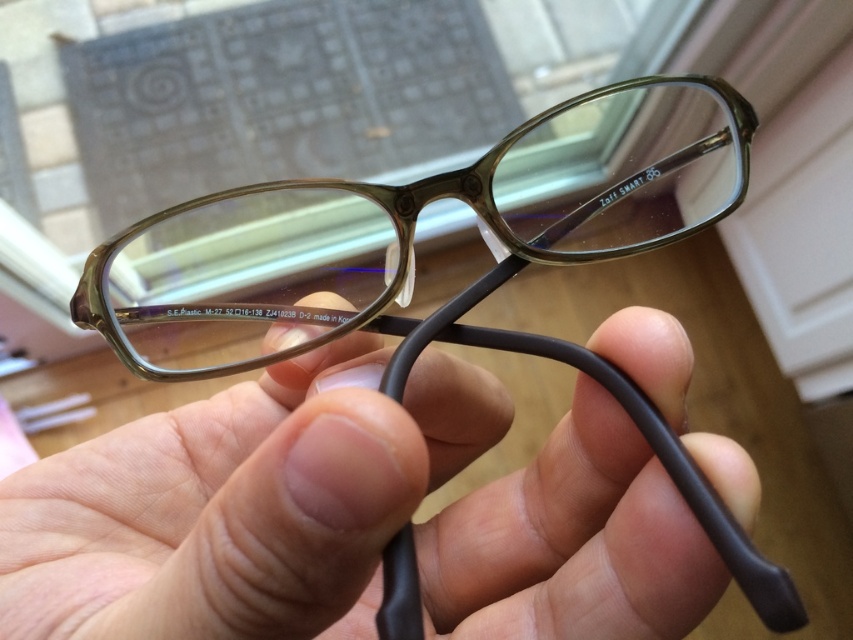
Question: Can you confirm if matte black glasses at center is wider than translucent plastic glasses at center?

Choices:
 (A) no
 (B) yes

Answer: (A)

Question: Is matte black glasses at center to the right of translucent plastic glasses at center from the viewer's perspective?

Choices:
 (A) yes
 (B) no

Answer: (B)

Question: Which point is closer to the camera?

Choices:
 (A) translucent plastic glasses at center
 (B) matte black glasses at center

Answer: (B)

Question: Which point is farther to the camera?

Choices:
 (A) matte black glasses at center
 (B) translucent plastic glasses at center

Answer: (B)

Question: Where is matte black glasses at center located in relation to translucent plastic glasses at center in the image?

Choices:
 (A) below
 (B) above

Answer: (A)